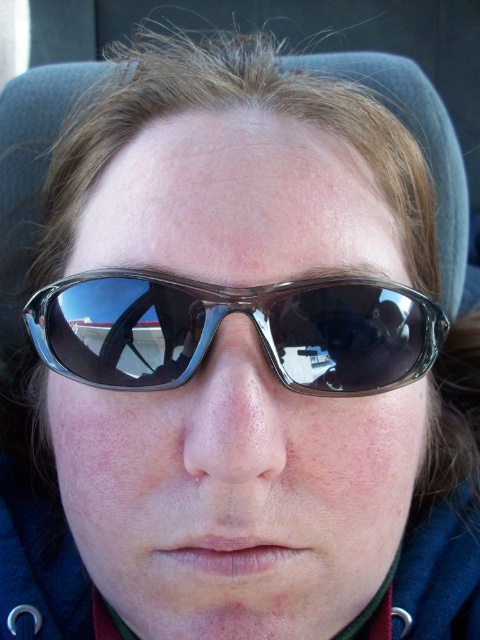
Question: Which of the following is the farthest from the observer?

Choices:
 (A) matte black nose at center
 (B) transparent plastic goggles at center

Answer: (B)

Question: Is transparent plastic goggles at center below matte black nose at center?

Choices:
 (A) yes
 (B) no

Answer: (B)

Question: Can you confirm if transparent plastic goggles at center is positioned above matte black nose at center?

Choices:
 (A) no
 (B) yes

Answer: (B)

Question: Which point is closer to the camera?

Choices:
 (A) (252, 358)
 (B) (69, 317)

Answer: (A)

Question: Considering the relative positions of transparent plastic goggles at center and matte black nose at center in the image provided, where is transparent plastic goggles at center located with respect to matte black nose at center?

Choices:
 (A) below
 (B) above

Answer: (B)